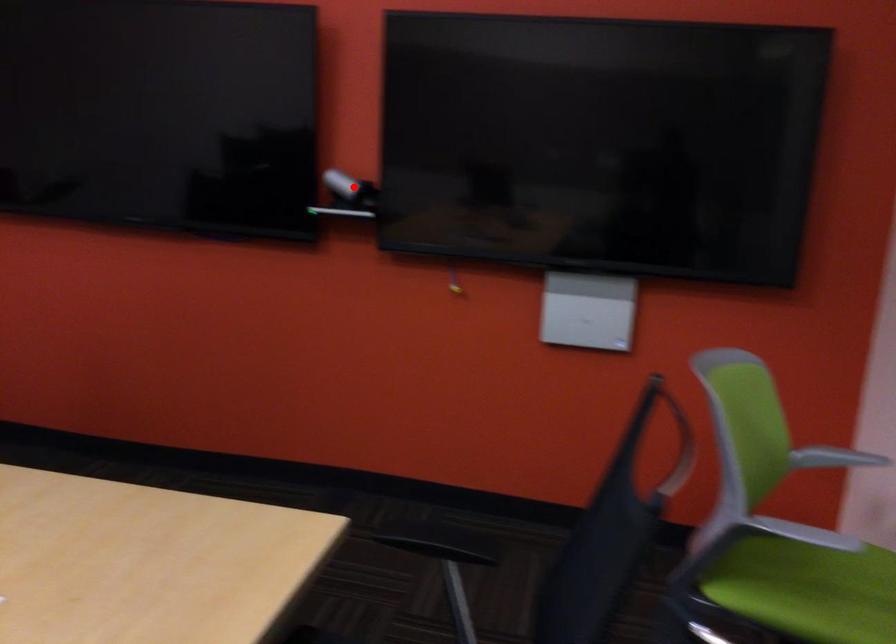
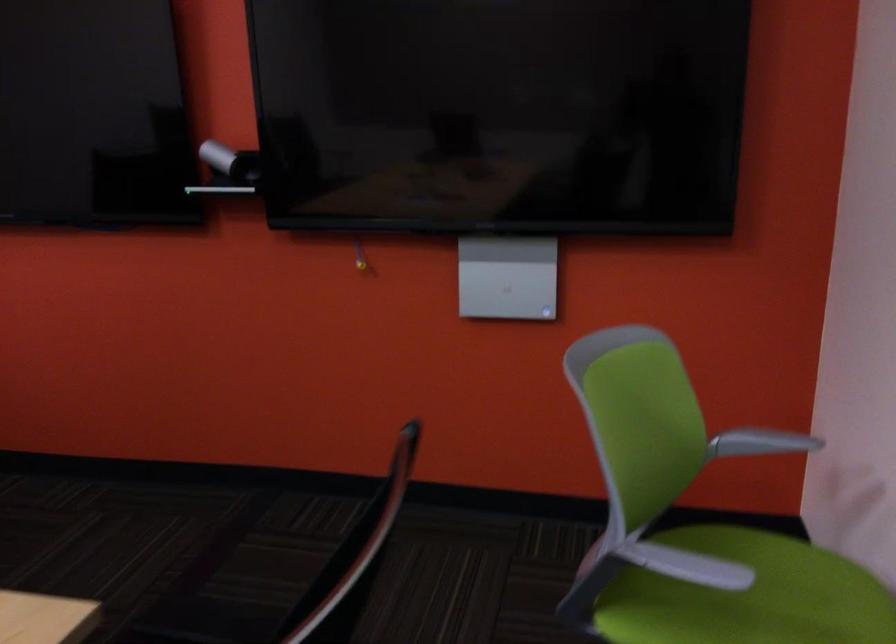
Where in the second image is the point corresponding to the highlighted location from the first image?

(230, 162)